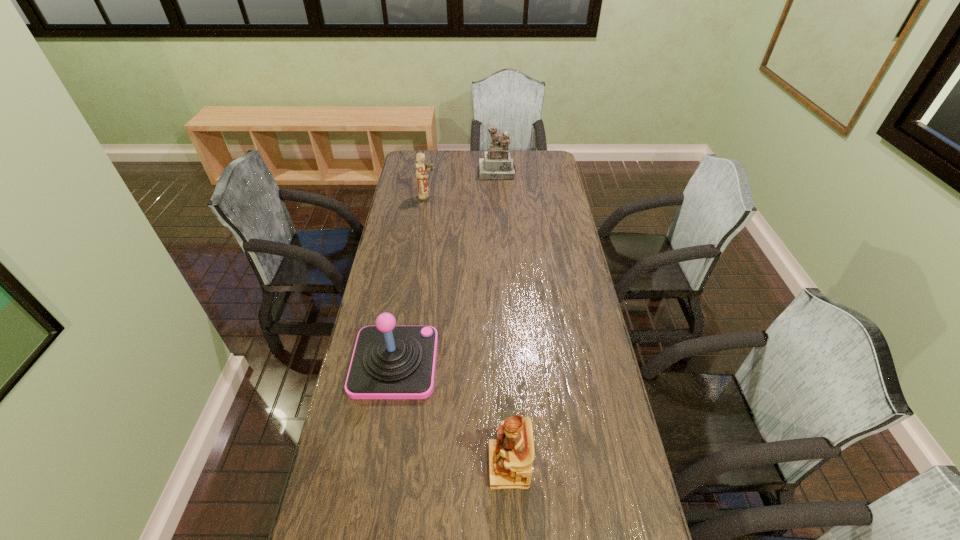
Locate an element on the screen. This screenshot has height=540, width=960. free space between the farthest figurine and the nearest object is located at coordinates (503, 319).

Identify the location of free space between the farthest figurine and the nearest object. (503, 319).

What are the coordinates of `empty space between the second farthest figurine and the nearest object` in the screenshot? It's located at (468, 332).

Identify the location of vacant space that is in between the second nearest object and the nearest figurine. (451, 414).

Where is `free space between the farthest figurine and the nearest figurine`? free space between the farthest figurine and the nearest figurine is located at coordinates (503, 319).

Locate an element on the screen. The width and height of the screenshot is (960, 540). blank region between the farthest object and the joystick is located at coordinates (445, 267).

Find the location of a particular element. vacant area between the nearest object and the third farthest object is located at coordinates (451, 414).

Where is `vacant space that's between the farthest figurine and the nearest figurine`? Image resolution: width=960 pixels, height=540 pixels. vacant space that's between the farthest figurine and the nearest figurine is located at coordinates (503, 319).

The width and height of the screenshot is (960, 540). Identify the location of object that is the third closest one to the second nearest object. (497, 164).

Image resolution: width=960 pixels, height=540 pixels. Find the location of `object that stands as the second closest to the farthest figurine`. object that stands as the second closest to the farthest figurine is located at coordinates (389, 362).